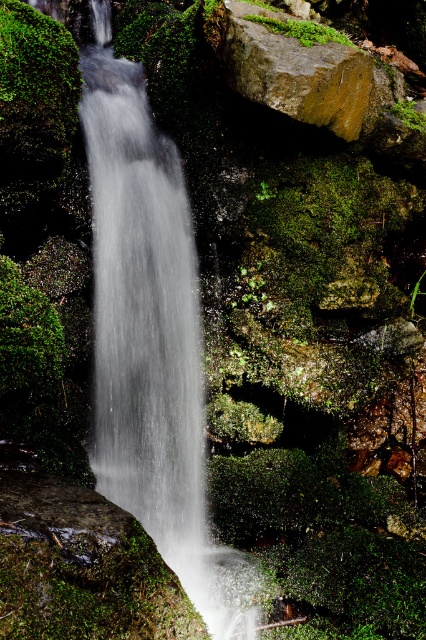
Which is above, white frothy water at center or green mossy rock at upper center?

green mossy rock at upper center

Does white frothy water at center lie behind green mossy rock at upper center?

No.

Is point (175, 371) farther from viewer compared to point (241, 40)?

No.

This screenshot has width=426, height=640. Find the location of `white frothy water at center`. white frothy water at center is located at coordinates (150, 339).